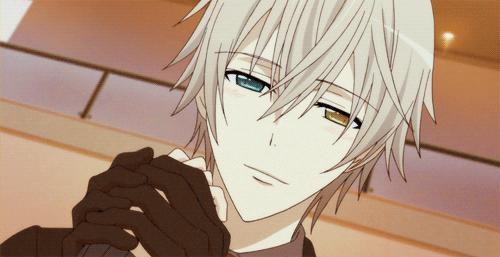
Locate an element on the screen. The width and height of the screenshot is (500, 257). wall is located at coordinates (382, 256), (466, 146).